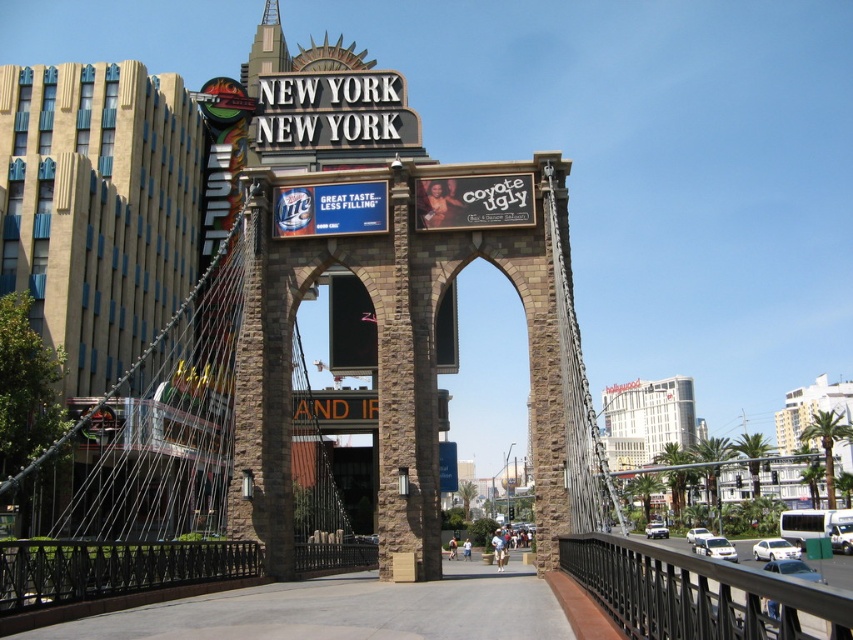
Question: Which object is closer to the camera taking this photo?

Choices:
 (A) white glossy car at lower right
 (B) white metallic sign at upper center
 (C) white glossy sedan at lower right

Answer: (C)

Question: Can you confirm if white glossy car at lower right is positioned below silver metallic car at center?

Choices:
 (A) yes
 (B) no

Answer: (B)

Question: Does matte black sign at upper center have a larger size compared to white glossy car at lower right?

Choices:
 (A) no
 (B) yes

Answer: (A)

Question: Is matte black sign at upper center above white glossy car at lower right?

Choices:
 (A) yes
 (B) no

Answer: (A)

Question: Which point is closer to the camera?

Choices:
 (A) white metallic sign at upper center
 (B) metallic silver sign at upper center
 (C) matte black sign at upper center

Answer: (C)

Question: Which of the following is the farthest from the observer?

Choices:
 (A) (700, 536)
 (B) (726, 541)
 (C) (651, 531)
 (D) (434, 202)

Answer: (C)